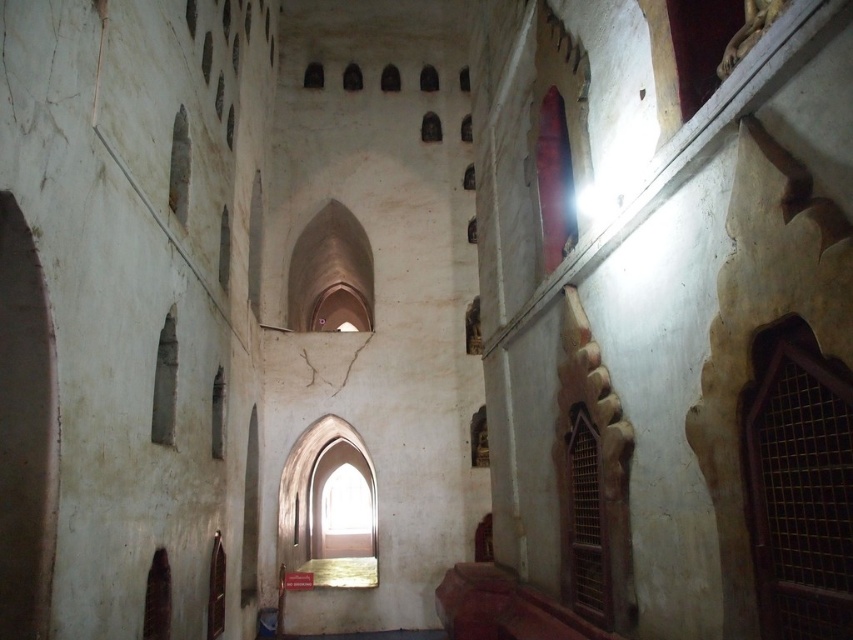
Which is below, smooth stone window at left or smooth stone window at upper left?

smooth stone window at left is below.

Between point (172, 323) and point (170, 209), which one is positioned in front?

Positioned in front is point (172, 323).

Where is `smooth stone window at left`? The image size is (853, 640). smooth stone window at left is located at coordinates (164, 384).

Does smooth stone window at left have a lesser height compared to transparent glass window at lower left?

No.

Is point (169, 333) less distant than point (223, 406)?

Yes.

At what (x,y) coordinates should I click in order to perform the action: click on smooth stone window at left. Please return your answer as a coordinate pair (x, y). Looking at the image, I should click on (164, 384).

Does gold metallic arch at center appear on the right side of brown wooden window at lower right?

In fact, gold metallic arch at center is to the left of brown wooden window at lower right.

What do you see at coordinates (312, 513) in the screenshot? The image size is (853, 640). I see `gold metallic arch at center` at bounding box center [312, 513].

Find the location of a particular element. gold metallic arch at center is located at coordinates (312, 513).